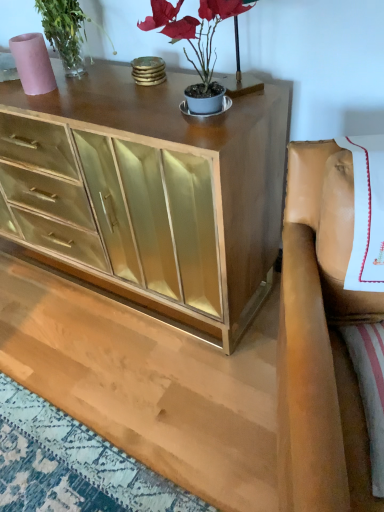
In order to click on free space in front of matte pink vase at upper left in this screenshot , I will do `click(42, 109)`.